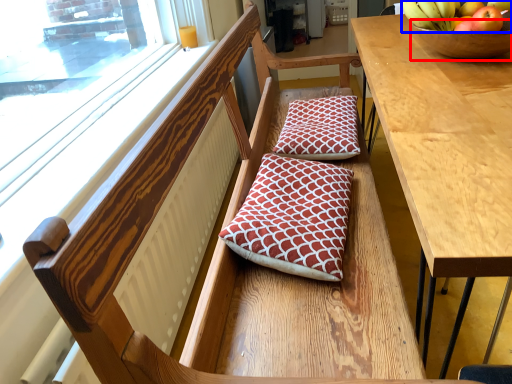
Question: Among these objects, which one is farthest to the camera, glass bowl (highlighted by a red box) or banana (highlighted by a blue box)?

Choices:
 (A) glass bowl
 (B) banana

Answer: (B)